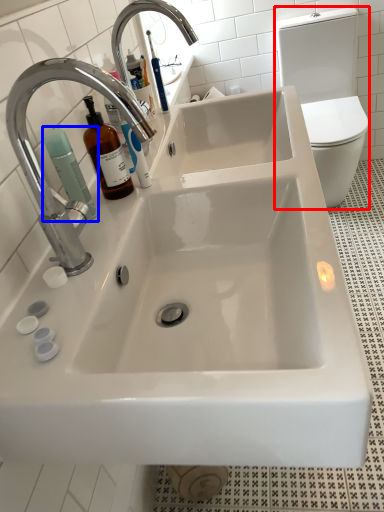
Question: Which of the following is the closest to the observer, toilet bowl (highlighted by a red box) or cleaning product (highlighted by a blue box)?

Choices:
 (A) toilet bowl
 (B) cleaning product

Answer: (B)